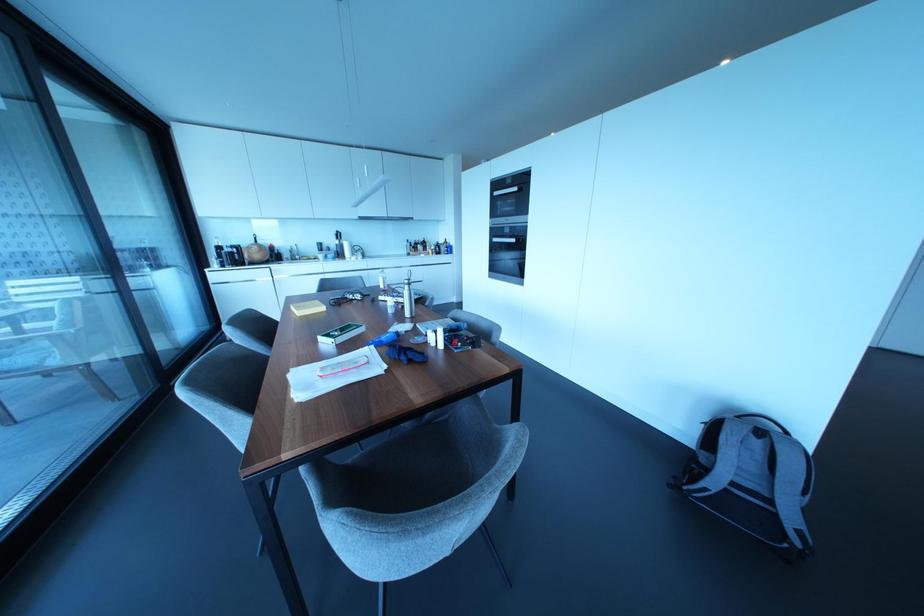
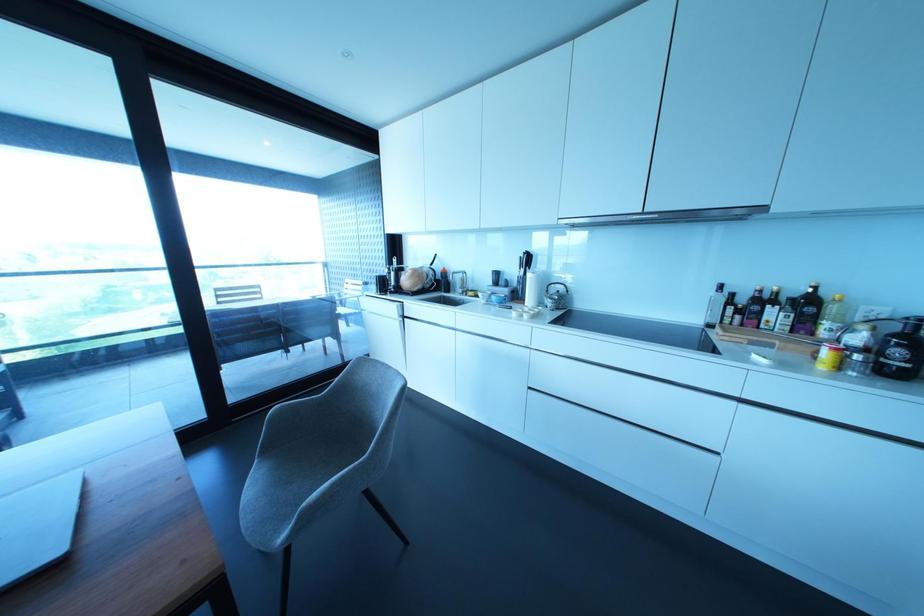
Find the pixel in the second image that matches point 329,254 in the first image.

(492, 297)